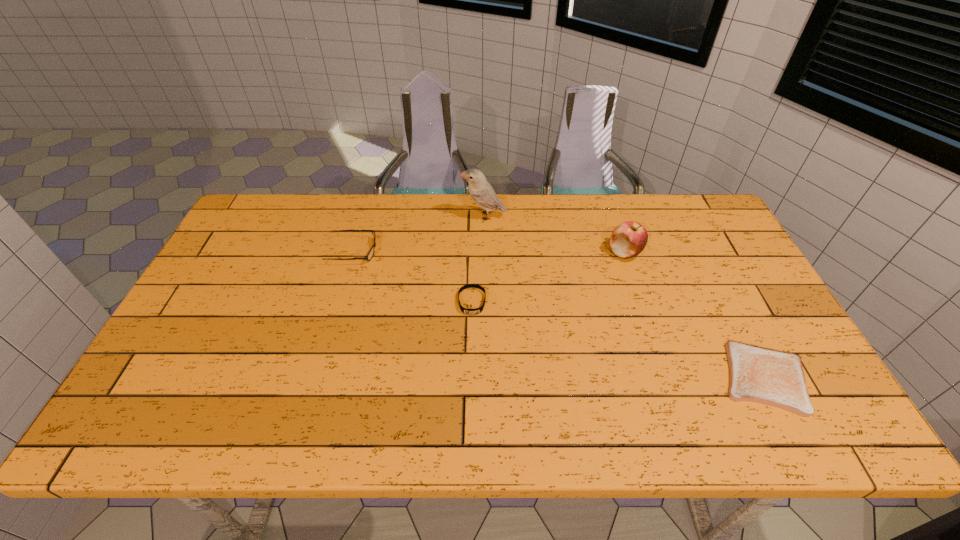
You are a GUI agent. You are given a task and a screenshot of the screen. Output one action in this format:
    pyautogui.click(x=<x>, y=<y>)
    Task: Click on the free point between the leftmost object and the farthest object
    The width and height of the screenshot is (960, 540).
    Given the screenshot: What is the action you would take?
    pyautogui.click(x=419, y=234)

The image size is (960, 540). Identify the location of vacant region between the third shortest object and the second tallest object. (490, 252).

Locate an element on the screen. vacant point located between the tallest object and the wristband is located at coordinates (478, 259).

The width and height of the screenshot is (960, 540). I want to click on vacant space that's between the farthest object and the third shortest object, so click(x=419, y=234).

The height and width of the screenshot is (540, 960). Find the location of `empty location between the apple and the leftmost object`. empty location between the apple and the leftmost object is located at coordinates (490, 252).

Find the location of a particular element. free space between the fourth farthest object and the bird is located at coordinates (478, 259).

Where is `free spot between the sunglasses and the tallest object`? free spot between the sunglasses and the tallest object is located at coordinates (419, 234).

Find the location of a particular element. vacant area that lies between the rightmost object and the apple is located at coordinates (695, 315).

Locate an element on the screen. This screenshot has height=540, width=960. object that ranks as the second closest to the toast is located at coordinates (478, 310).

Identify the location of object that ranks as the third closest to the third tallest object. The height and width of the screenshot is (540, 960). (628, 239).